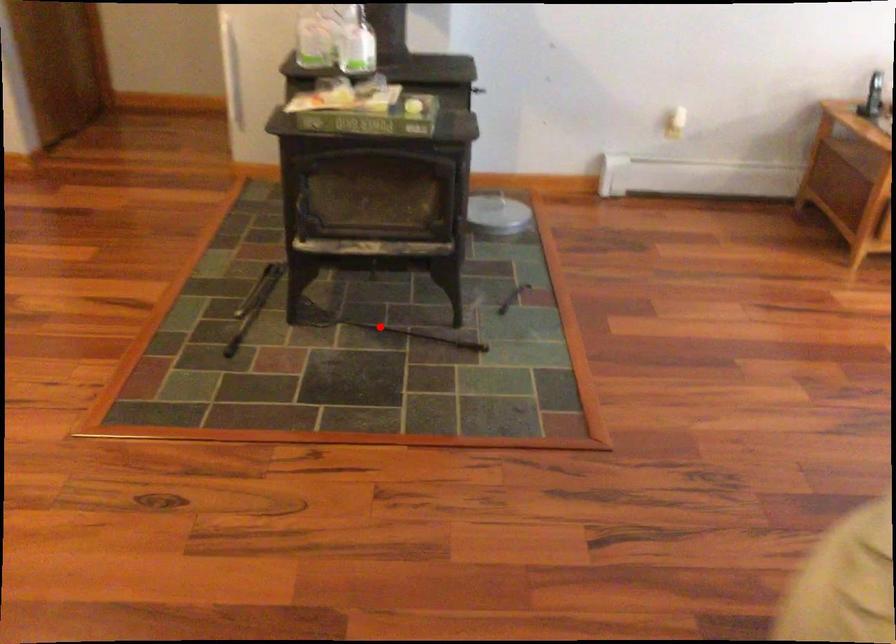
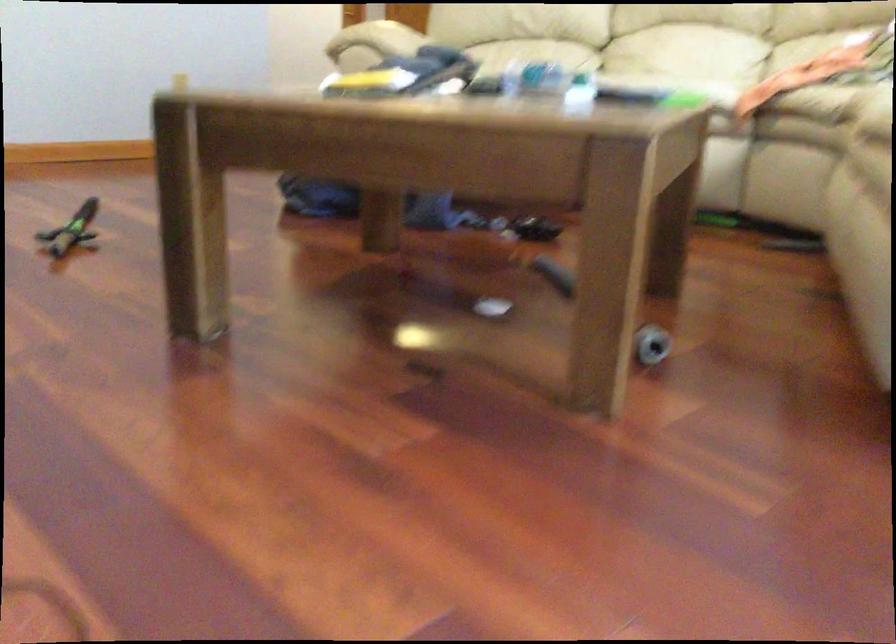
Question: I am providing you with two images of the same scene from different viewpoints. A red point is marked on the first image. Can you still see the location of the red point in image 2?

Choices:
 (A) Yes
 (B) No

Answer: (B)